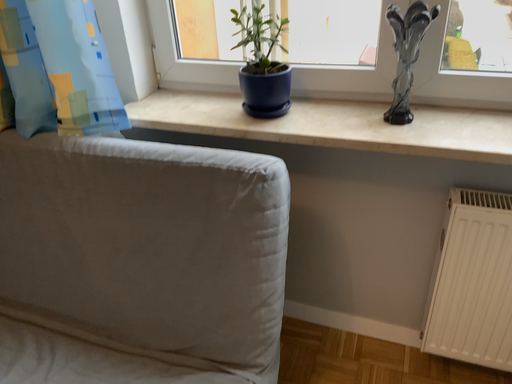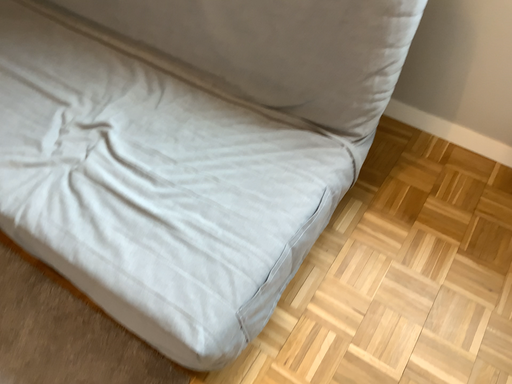
Question: How did the camera likely rotate when shooting the video?

Choices:
 (A) rotated downward
 (B) rotated upward

Answer: (A)